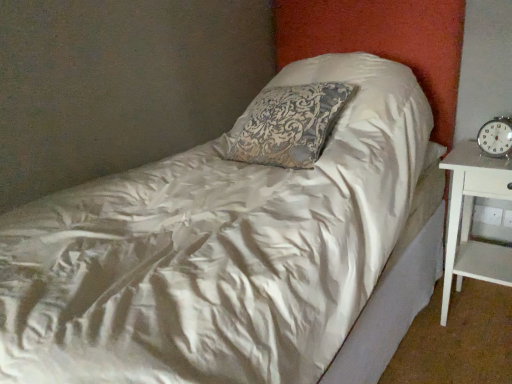
Question: In the image, is metallic silver clock at right positioned in front of or behind white wood nightstand at right?

Choices:
 (A) behind
 (B) front

Answer: (A)

Question: In terms of height, does metallic silver clock at right look taller or shorter compared to white wood nightstand at right?

Choices:
 (A) short
 (B) tall

Answer: (A)

Question: From the image's perspective, relative to white wood nightstand at right, is metallic silver clock at right above or below?

Choices:
 (A) below
 (B) above

Answer: (B)

Question: Is white wood nightstand at right inside or outside of metallic silver clock at right?

Choices:
 (A) outside
 (B) inside

Answer: (A)

Question: Looking at their shapes, would you say white wood nightstand at right is wider or thinner than metallic silver clock at right?

Choices:
 (A) wide
 (B) thin

Answer: (A)

Question: In the image, is white wood nightstand at right positioned in front of or behind metallic silver clock at right?

Choices:
 (A) behind
 (B) front

Answer: (B)

Question: Considering the positions of point (443, 324) and point (479, 134), is point (443, 324) closer or farther from the camera than point (479, 134)?

Choices:
 (A) closer
 (B) farther

Answer: (B)